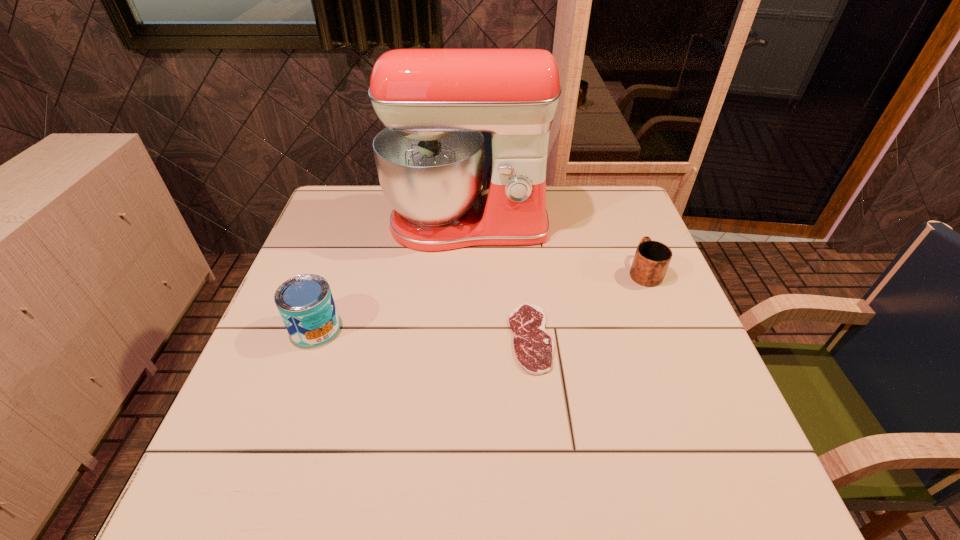
Where is `free space located on the side of the rightmost object with the handle`? free space located on the side of the rightmost object with the handle is located at coordinates (627, 229).

Find the location of a particular element. vacant space located on the front of the steak is located at coordinates (540, 418).

Find the location of a particular element. object present at the far edge is located at coordinates (435, 103).

Where is `object positioned at the left edge`? This screenshot has width=960, height=540. object positioned at the left edge is located at coordinates (305, 302).

Find the location of `object that is at the right edge`. object that is at the right edge is located at coordinates (652, 258).

Locate an element on the screen. The image size is (960, 540). vacant region at the far edge is located at coordinates (564, 190).

In the image, there is a desktop. Identify the location of free space at the near edge. This screenshot has height=540, width=960. (621, 465).

The height and width of the screenshot is (540, 960). In order to click on vacant area at the left edge in this screenshot , I will do `click(312, 408)`.

The width and height of the screenshot is (960, 540). In order to click on vacant region at the right edge of the desktop in this screenshot , I will do `click(617, 254)`.

In the image, there is a desktop. Where is `free space at the far left corner`? The width and height of the screenshot is (960, 540). free space at the far left corner is located at coordinates [351, 203].